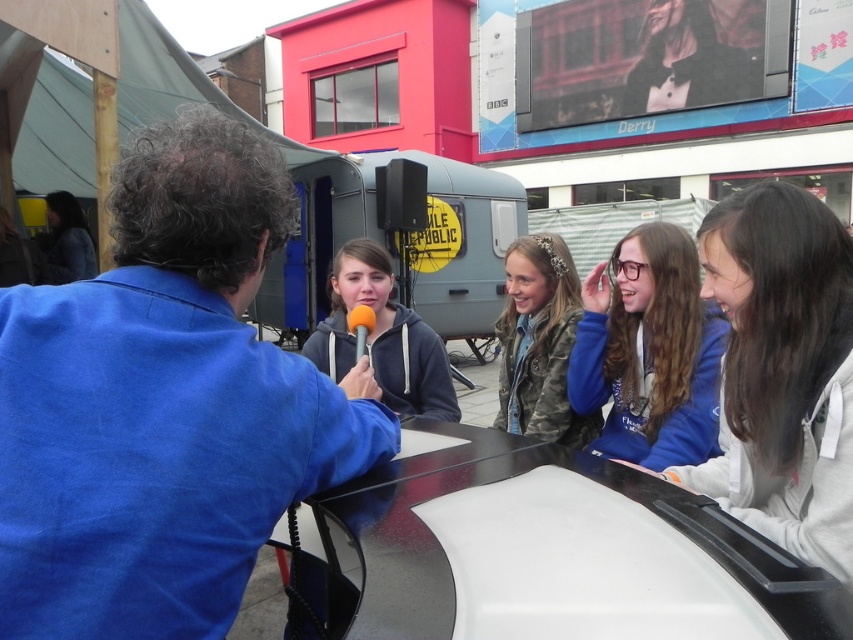
You are a photographer standing at the edge of the scene. You need to capture a photo of both the metallic silver trailer at center and the camouflage jacket at center in the same frame. Given that your camera has a maximum focal length that allows capturing objects up to 5 meters apart in the same shot, will you be able to include both objects in your photo?

The metallic silver trailer at center and camouflage jacket at center are 6.61 meters apart, which exceeds the camera maximum focal length of 5 meters. Therefore, you cannot include both objects in the same photo.

Based on the scene description, where is the metallic silver trailer at center located in terms of coordinates?

The metallic silver trailer at center is located at coordinates point (395, 243).